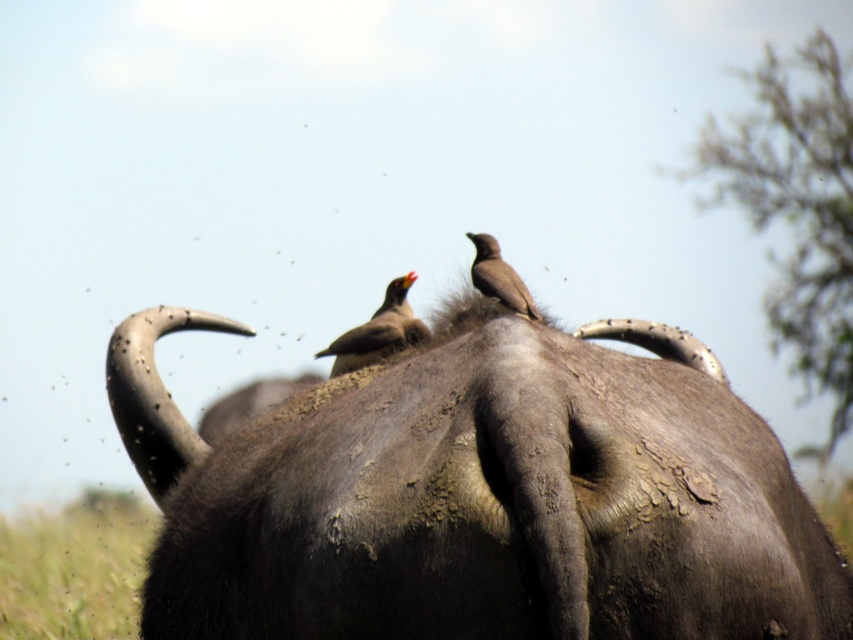
Question: Among these objects, which one is nearest to the camera?

Choices:
 (A) green grass at bottom left
 (B) brown feathered bird at center
 (C) dark gray textured hide at center

Answer: (C)

Question: Does green grass at bottom left lie behind brown matte bird at center?

Choices:
 (A) no
 (B) yes

Answer: (B)

Question: Is green grass at bottom left smaller than brown matte bird at center?

Choices:
 (A) yes
 (B) no

Answer: (B)

Question: Does dark gray textured hide at center have a larger size compared to brown matte bird at center?

Choices:
 (A) no
 (B) yes

Answer: (B)

Question: Which point is farther from the camera taking this photo?

Choices:
 (A) (560, 634)
 (B) (35, 561)
 (C) (383, 317)

Answer: (B)

Question: Among these objects, which one is farthest from the camera?

Choices:
 (A) green grass at bottom left
 (B) brown matte bird at center
 (C) brown feathered bird at center

Answer: (A)